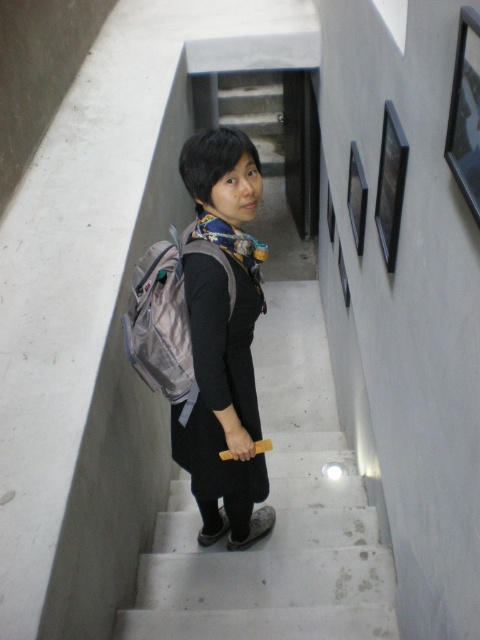
You are a drone operator trying to map the location of the stairs in the image. The image has a coordinate system where the bottom left corner is the origin. You need to determine if the point at coordinates point (277,516) is on the stairs. Can you confirm?

The point (277,516) corresponds to the matte gray stairs at center, so yes, the point is located on the stairs.

You are a delivery person needing to place a package on the matte gray stairs at center. Can you place the package in front of the silver fabric backpack at center?

The silver fabric backpack at center is behind the matte gray stairs at center, so placing the package in front of the silver fabric backpack at center would require placing it behind the stairs, which might not be accessible from the front. Therefore, it might not be possible to place the package in front of the silver fabric backpack at center while being on the matte gray stairs at center.

You are a delivery person carrying a heavy package and need to climb the stairs. The matte gray stairs at center and the matte gray backpack at center are in your path. Which object will you step on first?

The matte gray stairs at center is positioned under the matte gray backpack at center, so you will step on the matte gray stairs at center first.